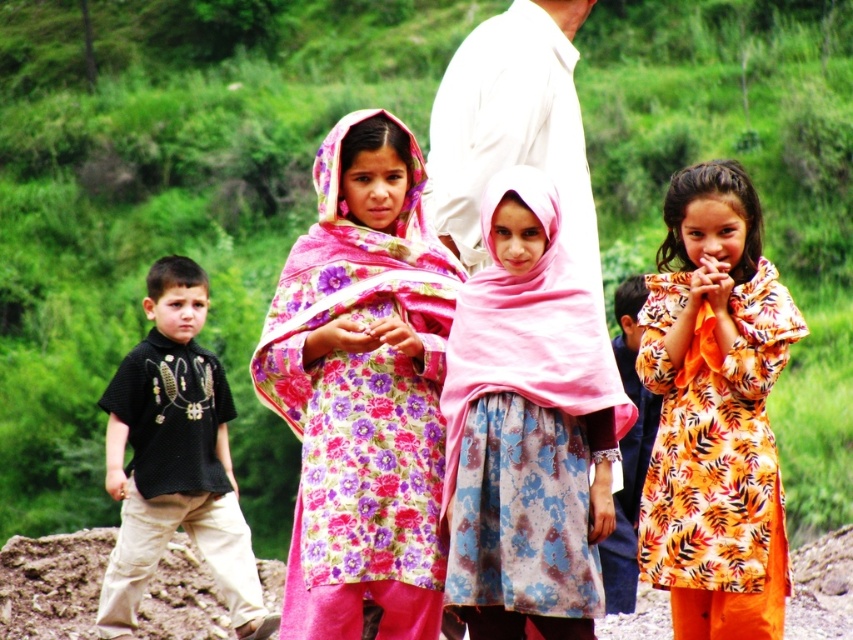
From the picture: Does black cotton shirt at left have a lesser height compared to dirt field at lower center?

Incorrect, black cotton shirt at left's height does not fall short of dirt field at lower center's.

Who is taller, black cotton shirt at left or dirt field at lower center?

With more height is black cotton shirt at left.

Is point (196, 385) closer to camera compared to point (816, 595)?

Yes, point (196, 385) is closer to viewer.

You are a GUI agent. You are given a task and a screenshot of the screen. Output one action in this format:
    pyautogui.click(x=<x>, y=<y>)
    Task: Click on the black cotton shirt at left
    The image size is (853, 640).
    Given the screenshot: What is the action you would take?
    pyautogui.click(x=173, y=458)

Between pink fabric headscarf at center and black cotton shirt at left, which one is positioned higher?

pink fabric headscarf at center is above.

What are the coordinates of `pink fabric headscarf at center` in the screenshot? It's located at (527, 426).

Which is behind, point (614, 458) or point (207, 547)?

The point (207, 547) is more distant.

In order to click on pink fabric headscarf at center in this screenshot , I will do `click(527, 426)`.

Does floral fabric dress at center have a lesser height compared to pink fabric headscarf at center?

In fact, floral fabric dress at center may be taller than pink fabric headscarf at center.

Does point (399, 435) come closer to viewer compared to point (521, 324)?

No.

The image size is (853, 640). Identify the location of floral fabric dress at center. (363, 388).